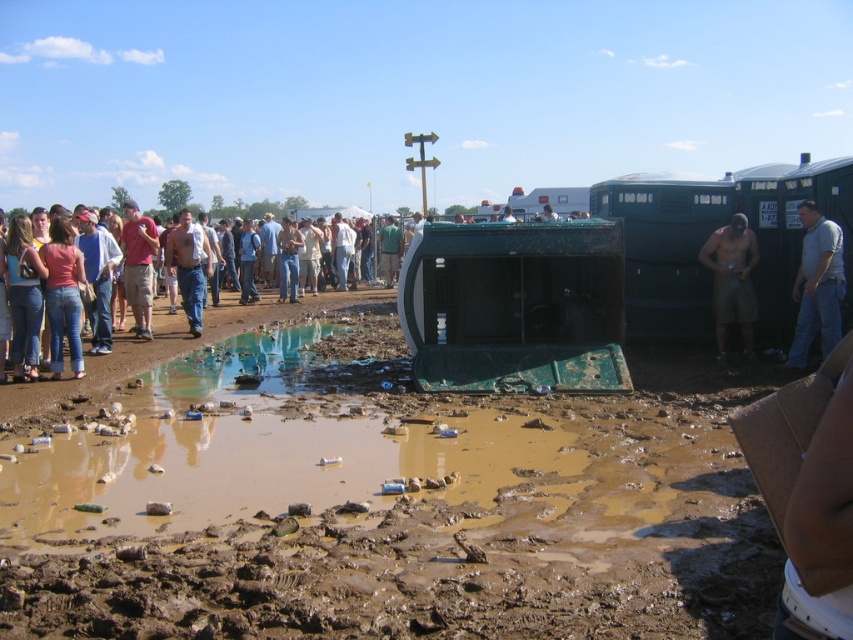
Question: Which of the following is the closest to the observer?

Choices:
 (A) tan cotton shirt at center
 (B) muddy water at center
 (C) tan shorts at right

Answer: (B)

Question: Does muddy brown dirt at center have a greater width compared to gray cotton shirt at right?

Choices:
 (A) no
 (B) yes

Answer: (B)

Question: Does muddy water at center have a greater width compared to denim jeans at center?

Choices:
 (A) yes
 (B) no

Answer: (B)

Question: In this image, where is gray cotton shirt at right located relative to matte red shirt at left?

Choices:
 (A) above
 (B) below

Answer: (B)

Question: Which of the following is the closest to the observer?

Choices:
 (A) denim jeans at center
 (B) muddy water at center
 (C) gray cotton shirt at right

Answer: (B)

Question: Estimate the real-world distances between objects in this image. Which object is closer to the denim jeans at center?

Choices:
 (A) muddy water at center
 (B) tan shorts at right

Answer: (A)